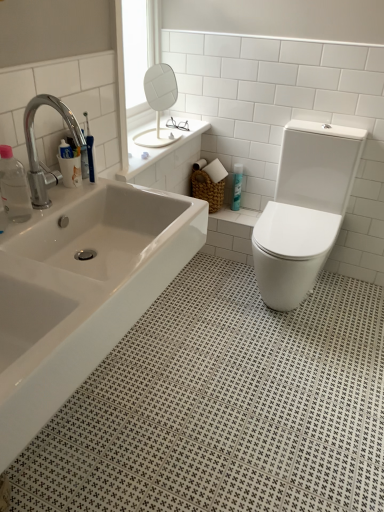
Describe the element at coordinates (304, 209) in the screenshot. The height and width of the screenshot is (512, 384). I see `white glossy toilet at right` at that location.

Where is `white glossy toilet at right`? This screenshot has width=384, height=512. white glossy toilet at right is located at coordinates (304, 209).

What is the approximate height of transparent plastic bottle at left, the second toiletry positioned from the top?

transparent plastic bottle at left, the second toiletry positioned from the top, is 8.70 inches tall.

I want to click on white glossy bathtub at center, so click(80, 288).

Locate an element on the screen. chrome metallic faucet at upper left is located at coordinates (36, 149).

Locate an element on the screen. white glossy toilet at right is located at coordinates (304, 209).

Is point (71, 133) closer or farther from the camera than point (24, 207)?

Clearly, point (71, 133) is more distant from the camera than point (24, 207).

Is chrome metallic faucet at upper left situated inside transparent plastic bottle at left, the 1th toiletry positioned from the bottom, or outside?

chrome metallic faucet at upper left is outside transparent plastic bottle at left, the 1th toiletry positioned from the bottom.

From the image's perspective, does chrome metallic faucet at upper left appear higher than transparent plastic bottle at left, the second toiletry positioned from the top?

Yes, from the image's perspective, chrome metallic faucet at upper left is over transparent plastic bottle at left, the second toiletry positioned from the top.

Between chrome metallic faucet at upper left and blue glossy spray can at center, which is the 1th toiletry from right to left, which one appears on the right side from the viewer's perspective?

Positioned to the right is blue glossy spray can at center, which is the 1th toiletry from right to left.

From a real-world perspective, is chrome metallic faucet at upper left over blue glossy spray can at center, the second toiletry when ordered from bottom to top?

Indeed, from a real-world perspective, chrome metallic faucet at upper left stands above blue glossy spray can at center, the second toiletry when ordered from bottom to top.

Which of these two, chrome metallic faucet at upper left or blue glossy spray can at center, positioned as the 2th toiletry in front-to-back order, is thinner?

Thinner between the two is blue glossy spray can at center, positioned as the 2th toiletry in front-to-back order.

Measure the distance between chrome metallic faucet at upper left and blue glossy spray can at center, arranged as the first toiletry when viewed from the back.

chrome metallic faucet at upper left is 4.21 feet from blue glossy spray can at center, arranged as the first toiletry when viewed from the back.

Considering the sizes of objects transparent plastic bottle at left, acting as the second toiletry starting from the right, and chrome metallic faucet at upper left in the image provided, who is wider, transparent plastic bottle at left, acting as the second toiletry starting from the right, or chrome metallic faucet at upper left?

chrome metallic faucet at upper left is wider.

Could you tell me if transparent plastic bottle at left, the second toiletry positioned from the top, is turned towards chrome metallic faucet at upper left?

No, transparent plastic bottle at left, the second toiletry positioned from the top, does not turn towards chrome metallic faucet at upper left.

Find the location of a particular element. This screenshot has height=512, width=384. toiletry located below the chrome metallic faucet at upper left (from the image's perspective) is located at coordinates (14, 186).

Is transparent plastic bottle at left, acting as the second toiletry starting from the right, bigger or smaller than chrome metallic faucet at upper left?

In the image, transparent plastic bottle at left, acting as the second toiletry starting from the right, appears to be smaller than chrome metallic faucet at upper left.

Find the location of `mirror on the right of transparent plastic bottle at left, the 1th toiletry positioned from the bottom`. mirror on the right of transparent plastic bottle at left, the 1th toiletry positioned from the bottom is located at coordinates (159, 104).

Is transparent plastic bottle at left, acting as the second toiletry starting from the right, spatially inside white glossy mirror at upper center, or outside of it?

transparent plastic bottle at left, acting as the second toiletry starting from the right, is not inside white glossy mirror at upper center, it's outside.

Is point (21, 208) closer to camera compared to point (161, 73)?

That is True.

From the image's perspective, is transparent plastic bottle at left, the 1th toiletry positioned from the bottom, on white glossy mirror at upper center?

Actually, transparent plastic bottle at left, the 1th toiletry positioned from the bottom, appears below white glossy mirror at upper center in the image.

Is blue glossy spray can at center, arranged as the first toiletry when viewed from the back, situated inside white glossy bathtub at center or outside?

blue glossy spray can at center, arranged as the first toiletry when viewed from the back, is spatially situated outside white glossy bathtub at center.

Does blue glossy spray can at center, arranged as the first toiletry when viewed from the back, appear on the left side of white glossy bathtub at center?

No, blue glossy spray can at center, arranged as the first toiletry when viewed from the back, is not to the left of white glossy bathtub at center.

Between blue glossy spray can at center, arranged as the first toiletry when viewed from the back, and white glossy bathtub at center, which one has smaller width?

blue glossy spray can at center, arranged as the first toiletry when viewed from the back, is thinner.

Considering the sizes of objects blue glossy spray can at center, marked as the first toiletry in a top-to-bottom arrangement, and white glossy bathtub at center in the image provided, who is taller, blue glossy spray can at center, marked as the first toiletry in a top-to-bottom arrangement, or white glossy bathtub at center?

Standing taller between the two is white glossy bathtub at center.

Would you say transparent plastic bottle at left, acting as the second toiletry starting from the right, is to the left or to the right of blue glossy spray can at center, the 2th toiletry when ordered from left to right, in the picture?

From the image, it's evident that transparent plastic bottle at left, acting as the second toiletry starting from the right, is to the left of blue glossy spray can at center, the 2th toiletry when ordered from left to right.

Is transparent plastic bottle at left, the second toiletry positioned from the top, placed right next to blue glossy spray can at center, positioned as the 2th toiletry in front-to-back order?

No.

From the image's perspective, is transparent plastic bottle at left, which is the first toiletry in left-to-right order, located above blue glossy spray can at center, positioned as the 2th toiletry in front-to-back order?

No, from the image's perspective, transparent plastic bottle at left, which is the first toiletry in left-to-right order, is not above blue glossy spray can at center, positioned as the 2th toiletry in front-to-back order.

Are white glossy bathtub at center and blue glossy spray can at center, arranged as the first toiletry when viewed from the back, far apart?

That's right, there is a large distance between white glossy bathtub at center and blue glossy spray can at center, arranged as the first toiletry when viewed from the back.

Between white glossy bathtub at center and blue glossy spray can at center, which is the 1th toiletry from right to left, which one has larger size?

With larger size is white glossy bathtub at center.

From a real-world perspective, is white glossy bathtub at center on blue glossy spray can at center, arranged as the first toiletry when viewed from the back?

Yes.

From the image's perspective, does white glossy bathtub at center appear lower than blue glossy spray can at center, positioned as the 2th toiletry in front-to-back order?

Yes, from the image's perspective, white glossy bathtub at center is beneath blue glossy spray can at center, positioned as the 2th toiletry in front-to-back order.

Where is `toiletry below the chrome metallic faucet at upper left (from the image's perspective)`? The image size is (384, 512). toiletry below the chrome metallic faucet at upper left (from the image's perspective) is located at coordinates (14, 186).

You are a GUI agent. You are given a task and a screenshot of the screen. Output one action in this format:
    pyautogui.click(x=<x>, y=<y>)
    Task: Click on the toiletry that is the 2nd object directly below the chrome metallic faucet at upper left (from a real-world perspective)
    This screenshot has width=384, height=512.
    Given the screenshot: What is the action you would take?
    pyautogui.click(x=237, y=187)

When comparing their distances from transparent plastic bottle at left, acting as the second toiletry starting from the right, does white glossy bathtub at center or white glossy toilet at right seem further?

white glossy toilet at right lies further to transparent plastic bottle at left, acting as the second toiletry starting from the right, than the other object.

Based on their spatial positions, is chrome metallic faucet at upper left or white glossy mirror at upper center closer to transparent plastic bottle at left, the second toiletry positioned from the top?

chrome metallic faucet at upper left.

When comparing their distances from blue glossy spray can at center, marked as the first toiletry in a top-to-bottom arrangement, does white glossy bathtub at center or white glossy toilet at right seem closer?

The object closer to blue glossy spray can at center, marked as the first toiletry in a top-to-bottom arrangement, is white glossy toilet at right.

Estimate the real-world distances between objects in this image. Which object is further from white glossy toilet at right, chrome metallic faucet at upper left or blue glossy spray can at center, marked as the first toiletry in a top-to-bottom arrangement?

chrome metallic faucet at upper left.

Based on their spatial positions, is blue glossy spray can at center, arranged as the first toiletry when viewed from the back, or white glossy bathtub at center closer to transparent plastic bottle at left, positioned as the 2th toiletry in back-to-front order?

white glossy bathtub at center.

Which object lies further to the anchor point white glossy toilet at right, transparent plastic bottle at left, the second toiletry positioned from the top, or blue glossy spray can at center, which is the 1th toiletry from right to left?

transparent plastic bottle at left, the second toiletry positioned from the top, is further to white glossy toilet at right.

Which object lies nearer to the anchor point white glossy mirror at upper center, transparent plastic bottle at left, which is the first toiletry in left-to-right order, or chrome metallic faucet at upper left?

chrome metallic faucet at upper left is closer to white glossy mirror at upper center.

Based on their spatial positions, is white glossy mirror at upper center or white glossy toilet at right further from white glossy bathtub at center?

white glossy mirror at upper center is further to white glossy bathtub at center.

The image size is (384, 512). Identify the location of mirror between white glossy bathtub at center and blue glossy spray can at center, positioned as the 2th toiletry in front-to-back order, along the z-axis. (159, 104).

Identify the location of mirror between white glossy toilet at right and blue glossy spray can at center, arranged as the first toiletry when viewed from the back, in the front-back direction. Image resolution: width=384 pixels, height=512 pixels. (159, 104).

Where is `tap between transparent plastic bottle at left, the 1th toiletry positioned from the bottom, and white glossy toilet at right`? The image size is (384, 512). tap between transparent plastic bottle at left, the 1th toiletry positioned from the bottom, and white glossy toilet at right is located at coordinates (36, 149).

Where is `mirror between chrome metallic faucet at upper left and blue glossy spray can at center, arranged as the first toiletry when viewed from the back, along the z-axis`? The image size is (384, 512). mirror between chrome metallic faucet at upper left and blue glossy spray can at center, arranged as the first toiletry when viewed from the back, along the z-axis is located at coordinates (159, 104).